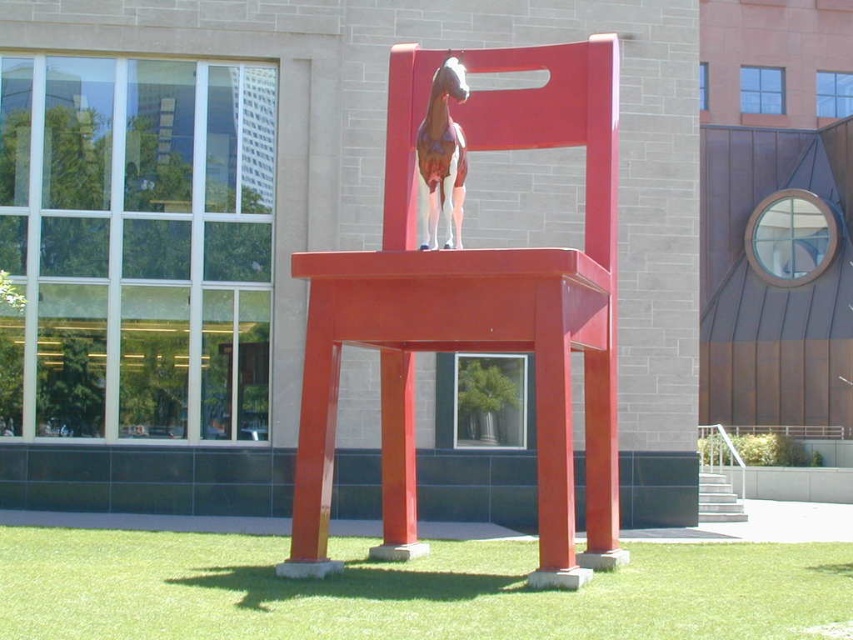
Between point (363, 556) and point (428, 227), which one is positioned behind?

Point (363, 556)

Who is higher up, green grass at lower center or painted wood horse at center?

painted wood horse at center is above.

Which is behind, point (450, 612) or point (447, 156)?

The point (447, 156) is more distant.

Locate an element on the screen. green grass at lower center is located at coordinates (405, 589).

Is the position of matte red chair at center more distant than that of green grass at lower center?

Yes, it is behind green grass at lower center.

Does matte red chair at center appear under green grass at lower center?

Actually, matte red chair at center is above green grass at lower center.

Describe the element at coordinates (477, 310) in the screenshot. The height and width of the screenshot is (640, 853). I see `matte red chair at center` at that location.

Find the location of a particular element. matte red chair at center is located at coordinates (477, 310).

Can you confirm if matte red chair at center is positioned to the left of painted wood horse at center?

In fact, matte red chair at center is to the right of painted wood horse at center.

At what (x,y) coordinates should I click in order to perform the action: click on matte red chair at center. Please return your answer as a coordinate pair (x, y). Image resolution: width=853 pixels, height=640 pixels. Looking at the image, I should click on (477, 310).

Where is `matte red chair at center`? The height and width of the screenshot is (640, 853). matte red chair at center is located at coordinates (477, 310).